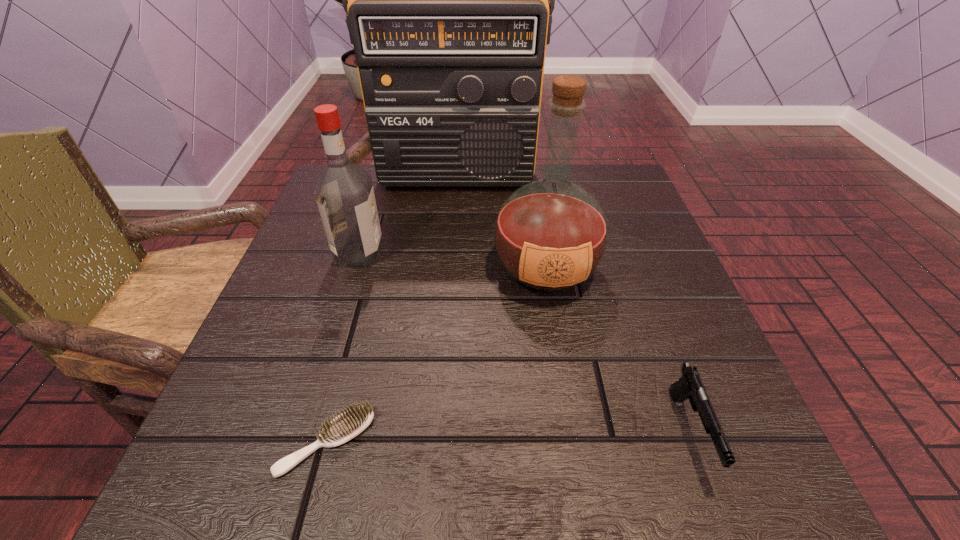
Find the location of a particular element. This screenshot has width=960, height=540. object present at the far left corner is located at coordinates (446, 0).

Identify the location of object at the near left corner. (349, 424).

Find the location of `object that is at the near right corner`. object that is at the near right corner is located at coordinates pos(690,386).

At what (x,y) coordinates should I click in order to perform the action: click on free space at the far edge. Please return your answer as a coordinate pair (x, y). Looking at the image, I should click on (449, 208).

Find the location of `free space at the near edge`. free space at the near edge is located at coordinates (578, 443).

The width and height of the screenshot is (960, 540). In order to click on vacant space at the left edge of the desktop in this screenshot , I will do `click(287, 395)`.

The height and width of the screenshot is (540, 960). What are the coordinates of `vacant region at the right edge of the desktop` in the screenshot? It's located at (612, 232).

Where is `free location at the far right corner`? The height and width of the screenshot is (540, 960). free location at the far right corner is located at coordinates (638, 217).

Find the location of a particular element. Image resolution: width=960 pixels, height=540 pixels. vacant space at the near right corner is located at coordinates (684, 459).

You are a GUI agent. You are given a task and a screenshot of the screen. Output one action in this format:
    pyautogui.click(x=<x>, y=<y>)
    Task: Click on the unoccupied area between the second shortest object and the farthest object
    The image size is (960, 540).
    Given the screenshot: What is the action you would take?
    pyautogui.click(x=572, y=305)